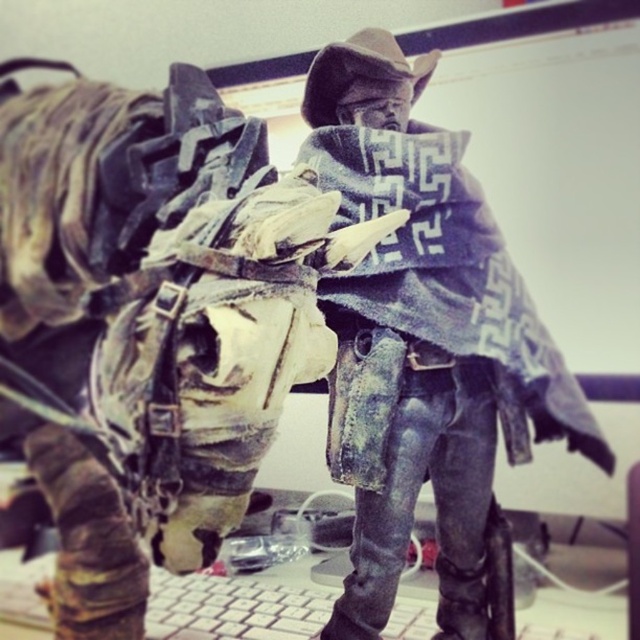
Who is more distant from viewer, (115, 584) or (397, 104)?

Point (397, 104)

Identify the location of worn leather jacket at center. Image resolution: width=640 pixels, height=640 pixels. 152,321.